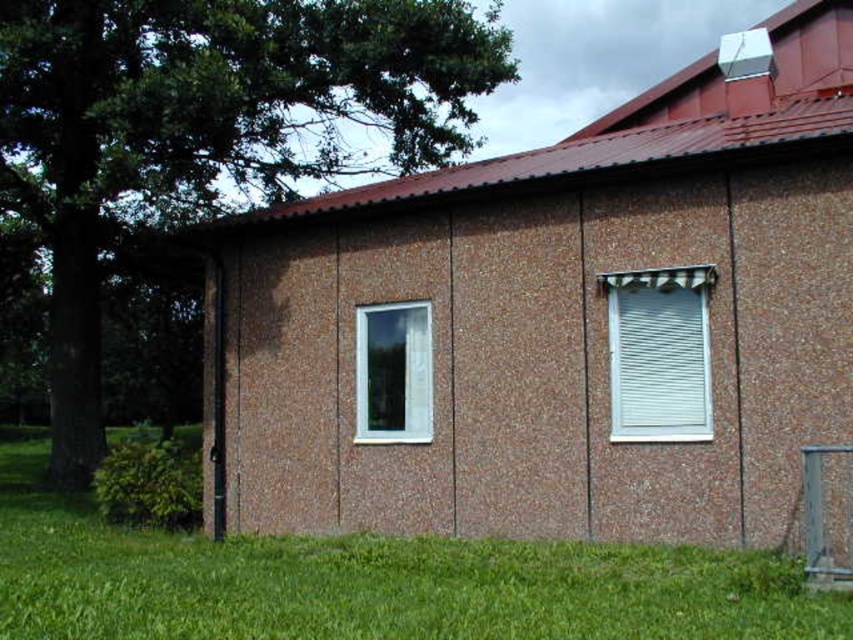
Can you confirm if green leafy tree at left is positioned to the right of white textured blinds at right?

Incorrect, green leafy tree at left is not on the right side of white textured blinds at right.

Is green leafy tree at left wider than white textured blinds at right?

Yes.

Image resolution: width=853 pixels, height=640 pixels. Identify the location of green leafy tree at left. (206, 129).

Locate an element on the screen. The image size is (853, 640). green leafy tree at left is located at coordinates (206, 129).

Is brown textured wall at center taller than clear glass window at center?

Indeed, brown textured wall at center has a greater height compared to clear glass window at center.

Is brown textured wall at center wider than clear glass window at center?

Correct, the width of brown textured wall at center exceeds that of clear glass window at center.

Which is in front, point (256, 401) or point (413, 362)?

Point (413, 362) is in front.

At what (x,y) coordinates should I click in order to perform the action: click on brown textured wall at center. Please return your answer as a coordinate pair (x, y). Looking at the image, I should click on (567, 317).

Can you confirm if green leafy tree at left is bigger than clear glass window at center?

Indeed, green leafy tree at left has a larger size compared to clear glass window at center.

Does green leafy tree at left come in front of clear glass window at center?

No.

Does point (223, 12) lie behind point (410, 316)?

Yes, point (223, 12) is behind point (410, 316).

Locate an element on the screen. This screenshot has width=853, height=640. green leafy tree at left is located at coordinates (206, 129).